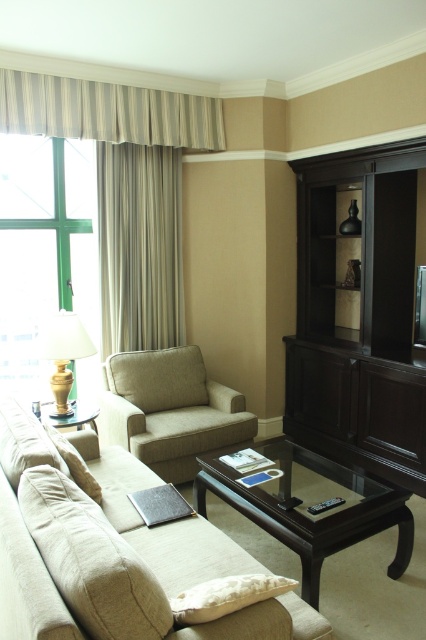
In the scene shown: You are trying to decide whether to place a large painting on the wall next to the striped fabric curtain at left and the green glass window at left. Which object should you consider the width of to ensure the painting will fit properly?

You should consider the width of the striped fabric curtain at left because it might be wider than the green glass window at left, so measuring its width will help ensure the painting fits appropriately.

You are sitting on the beige fabric couch at lower left and want to turn on the matte beige lamp at left. Can you reach it without getting up?

The beige fabric couch at lower left is in front of the matte beige lamp at left, so you can likely reach it without getting up as they are positioned close to each other.